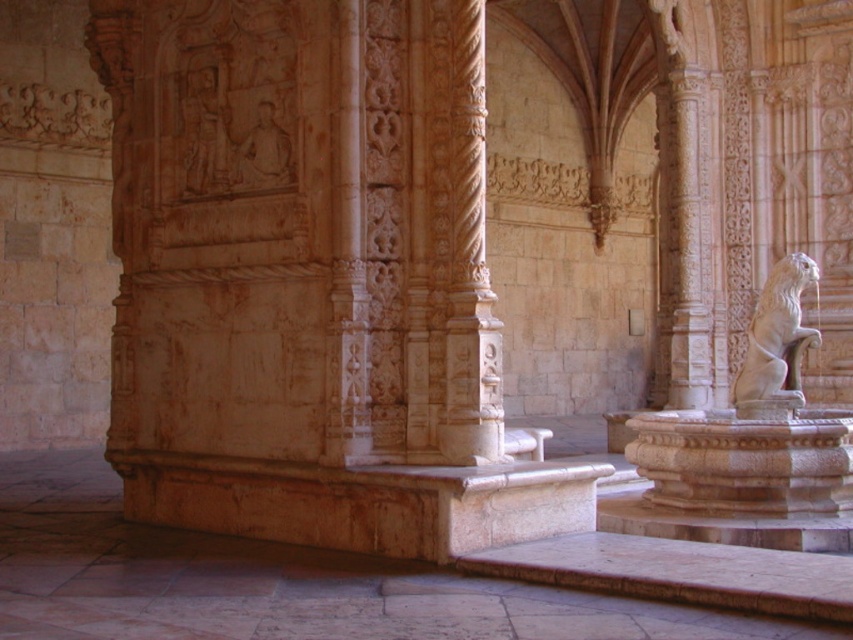
Who is positioned more to the right, carved stone column at center or white stone lion at right?

Positioned to the right is white stone lion at right.

Does point (360, 124) come farther from viewer compared to point (756, 340)?

That is False.

The height and width of the screenshot is (640, 853). What are the coordinates of `carved stone column at center` in the screenshot? It's located at (347, 257).

Does point (485, 310) come closer to viewer compared to point (808, 280)?

That is True.

The image size is (853, 640). What do you see at coordinates (469, 260) in the screenshot?
I see `white stone column at center` at bounding box center [469, 260].

Identify the location of white stone column at center. The width and height of the screenshot is (853, 640). (469, 260).

Can you confirm if white stone column at center is thinner than carved stone column at center?

Incorrect, white stone column at center's width is not less than carved stone column at center's.

Does white stone column at center come behind carved stone column at center?

No.

Which is in front, point (471, 257) or point (357, 33)?

Positioned in front is point (471, 257).

The width and height of the screenshot is (853, 640). Identify the location of white stone column at center. (469, 260).